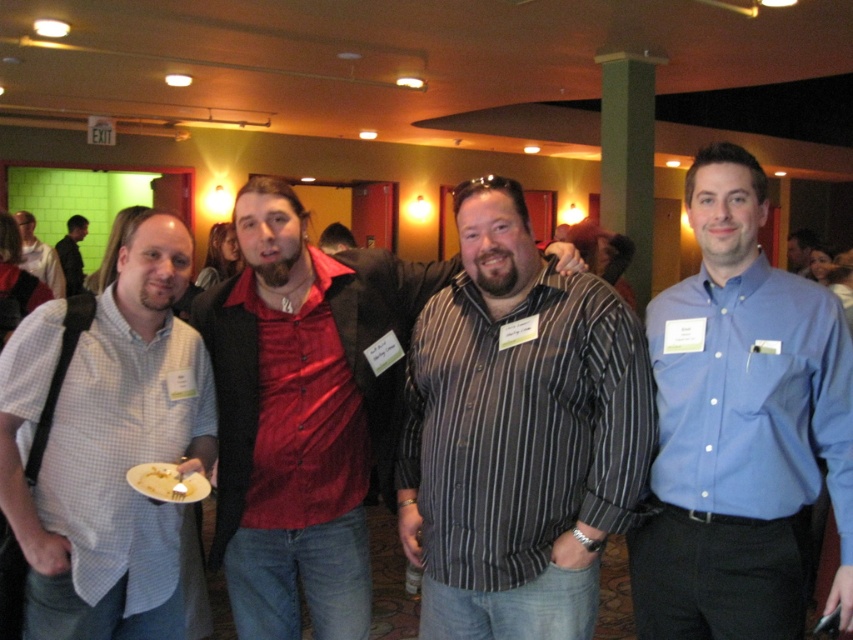
You are a photographer at an event and need to adjust the lighting to ensure both the white checkered shirt at left and the dark gray leather jacket at left are well lit. Which one requires more focused lighting due to its material properties?

The white checkered shirt at left requires more focused lighting because it is thinner and may reflect more light compared to the dark gray leather jacket at left.

You are a photographer at a social event. You need to adjust the lighting to ensure the white checkered shirt at left and the dark gray leather jacket at left are both visible. Which item is closer to the light source?

The white checkered shirt at left is positioned under dark gray leather jacket at left, so it is closer to the light source.